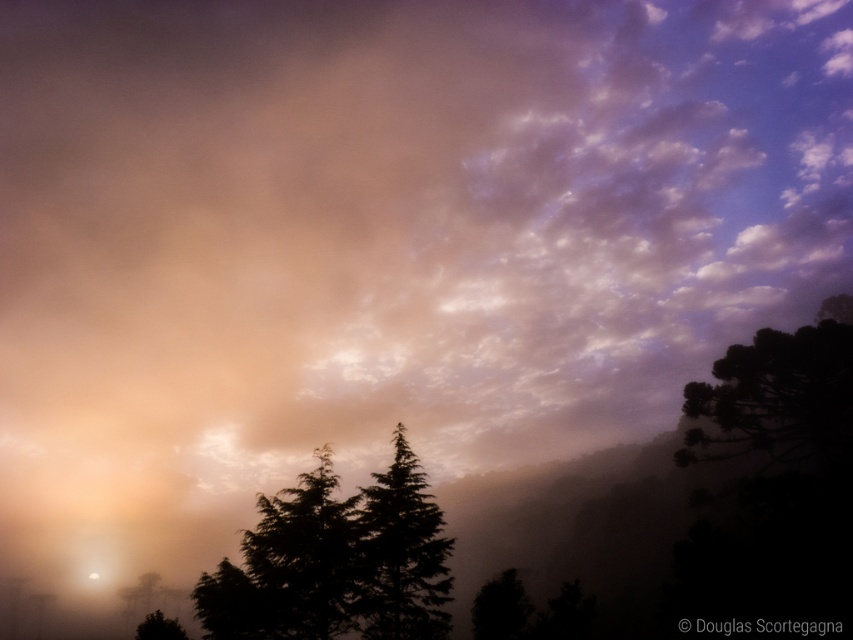
From the picture: Which is more to the left, dark green textured tree at right or dark green leafy tree at lower left?

From the viewer's perspective, dark green leafy tree at lower left appears more on the left side.

Identify the location of dark green textured tree at right. This screenshot has width=853, height=640. click(775, 397).

What do you see at coordinates (775, 397) in the screenshot? The width and height of the screenshot is (853, 640). I see `dark green textured tree at right` at bounding box center [775, 397].

I want to click on dark green textured tree at right, so click(775, 397).

Does point (370, 588) come behind point (135, 637)?

No, (370, 588) is in front of (135, 637).

Where is `dark green textured tree at center`? Image resolution: width=853 pixels, height=640 pixels. dark green textured tree at center is located at coordinates [x=335, y=561].

Is dark green textured tree at center to the right of dark green textured tree at right from the viewer's perspective?

No, dark green textured tree at center is not to the right of dark green textured tree at right.

Who is taller, dark green textured tree at center or dark green textured tree at right?

Standing taller between the two is dark green textured tree at right.

Is point (367, 534) positioned behind point (755, 419)?

No, (367, 534) is closer to viewer.

This screenshot has width=853, height=640. I want to click on dark green textured tree at center, so click(x=335, y=561).